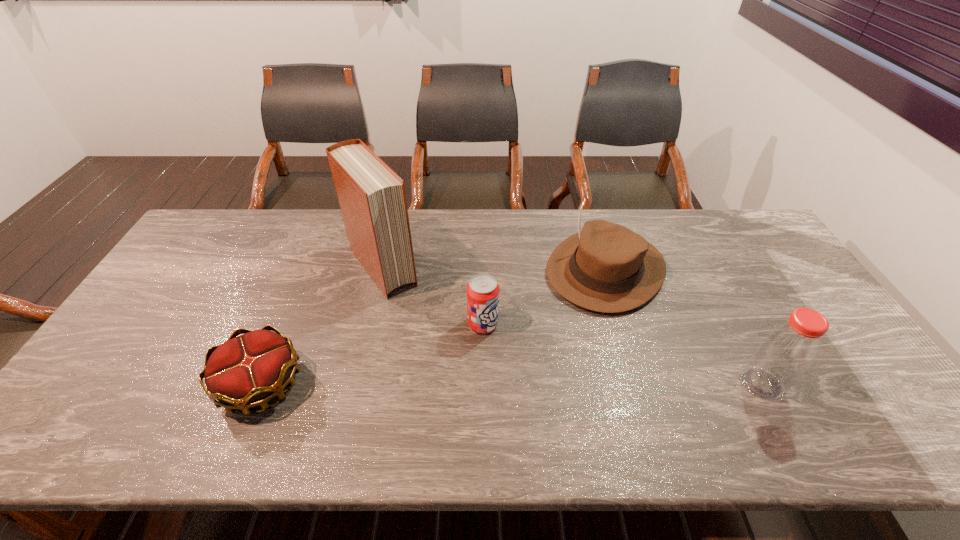
The height and width of the screenshot is (540, 960). What are the coordinates of `vacant space situated on the back of the shortest object` in the screenshot? It's located at (310, 266).

Where is `vacant area located on the back of the bottle`? The width and height of the screenshot is (960, 540). vacant area located on the back of the bottle is located at coordinates (733, 330).

Where is `free space located on the open cover of the hardback book`? The width and height of the screenshot is (960, 540). free space located on the open cover of the hardback book is located at coordinates (418, 317).

Where is `vacant space located on the open cover of the hardback book`? The image size is (960, 540). vacant space located on the open cover of the hardback book is located at coordinates (440, 345).

What are the coordinates of `free spot located 0.180m on the open cover of the hardback book` in the screenshot? It's located at (430, 333).

At what (x,y) coordinates should I click in order to perform the action: click on free space located on the surface of the third object from left to right. Please return your answer as a coordinate pair (x, y). Looking at the image, I should click on (542, 374).

This screenshot has height=540, width=960. Find the location of `vacant region located on the surface of the third object from left to right`. vacant region located on the surface of the third object from left to right is located at coordinates (573, 401).

Locate an element on the screen. The image size is (960, 540). vacant space located on the surface of the third object from left to right is located at coordinates (570, 398).

The image size is (960, 540). Identify the location of free space located on the feather side of the fedora. (522, 359).

Where is `free space located on the feather side of the fedora`? This screenshot has width=960, height=540. free space located on the feather side of the fedora is located at coordinates (542, 338).